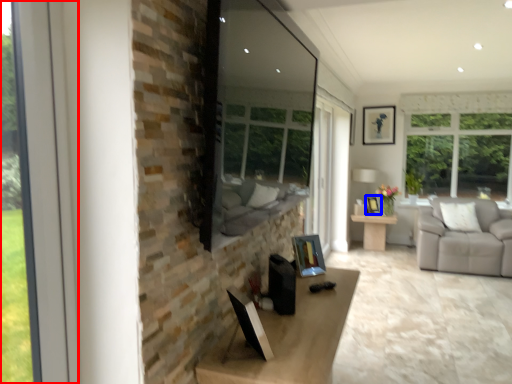
Question: Among these objects, which one is nearest to the camera, window (highlighted by a red box) or picture frame (highlighted by a blue box)?

Choices:
 (A) window
 (B) picture frame

Answer: (A)